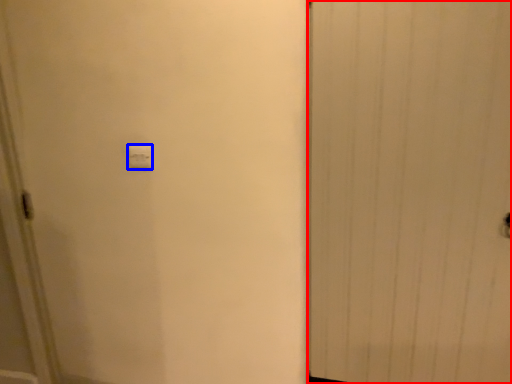
Question: Which object appears closest to the camera in this image, door (highlighted by a red box) or light switch (highlighted by a blue box)?

Choices:
 (A) door
 (B) light switch

Answer: (A)